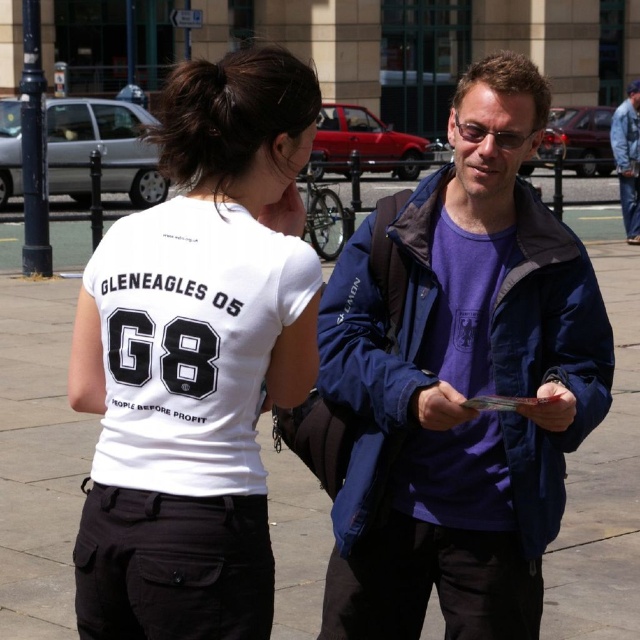
Is white cotton t-shirt at upper left to the left of denim jacket at upper right from the viewer's perspective?

Correct, you'll find white cotton t-shirt at upper left to the left of denim jacket at upper right.

Which of these two, white cotton t-shirt at upper left or denim jacket at upper right, stands shorter?

With less height is white cotton t-shirt at upper left.

You are a GUI agent. You are given a task and a screenshot of the screen. Output one action in this format:
    pyautogui.click(x=<x>, y=<y>)
    Task: Click on the white cotton t-shirt at upper left
    The image size is (640, 640).
    Given the screenshot: What is the action you would take?
    pyautogui.click(x=196, y=358)

Where is `white cotton t-shirt at upper left`? The image size is (640, 640). white cotton t-shirt at upper left is located at coordinates (196, 358).

Is smooth concrete pavement at center below denim jacket at upper right?

Yes.

Based on the photo, between smooth concrete pavement at center and denim jacket at upper right, which one is positioned lower?

smooth concrete pavement at center

Which is in front, point (282, 577) or point (611, 122)?

Point (282, 577) is more forward.

The image size is (640, 640). What are the coordinates of `smooth concrete pavement at center` in the screenshot? It's located at (38, 449).

Does purple softshell jacket at center lie in front of denim jacket at upper right?

Yes.

Can you confirm if purple softshell jacket at center is thinner than denim jacket at upper right?

Incorrect, purple softshell jacket at center's width is not less than denim jacket at upper right's.

Which is behind, point (332, 556) or point (627, 90)?

The point (627, 90) is behind.

Locate an element on the screen. purple softshell jacket at center is located at coordinates (461, 384).